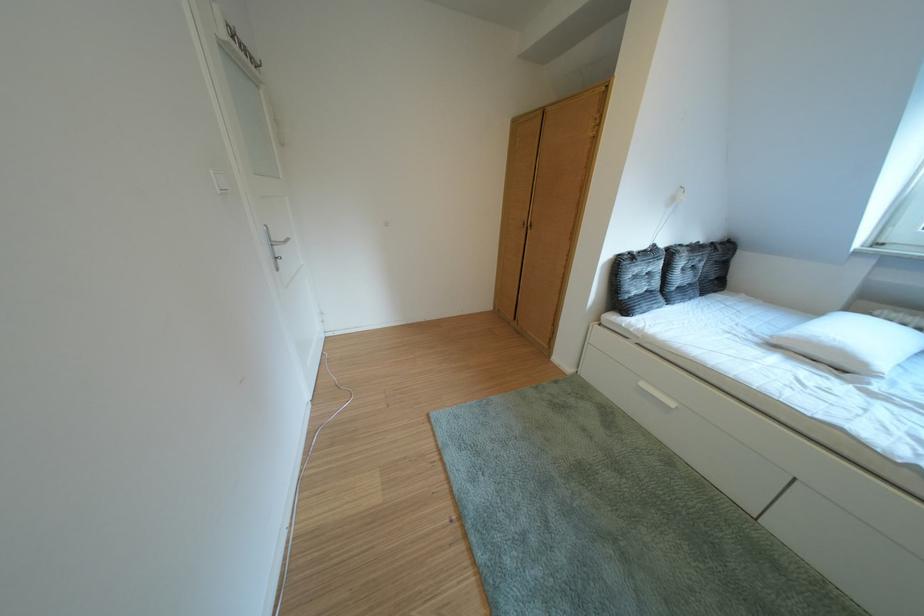
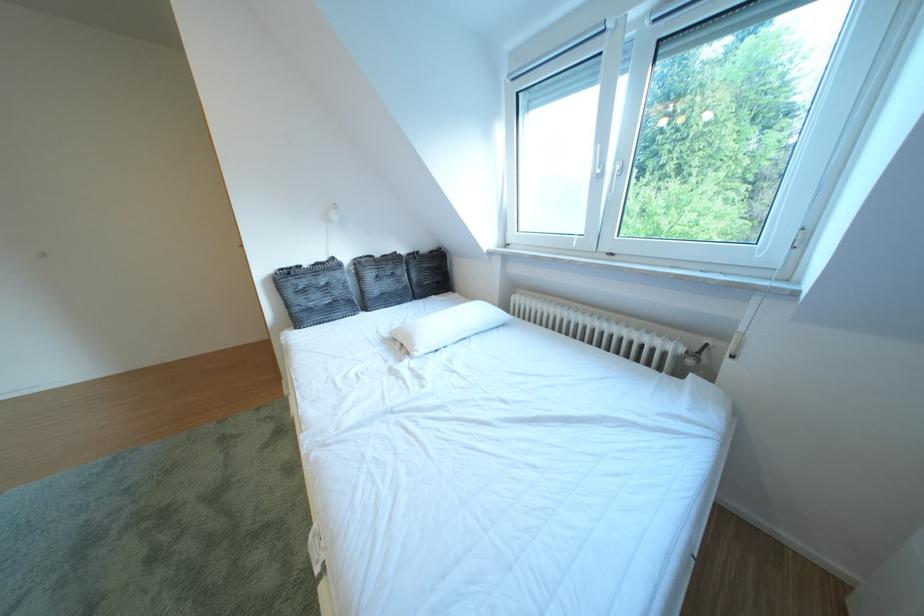
Question: The images are taken continuously from a first-person perspective. In which direction are you moving?

Choices:
 (A) Left
 (B) Right
 (C) Forward
 (D) Backward

Answer: (B)